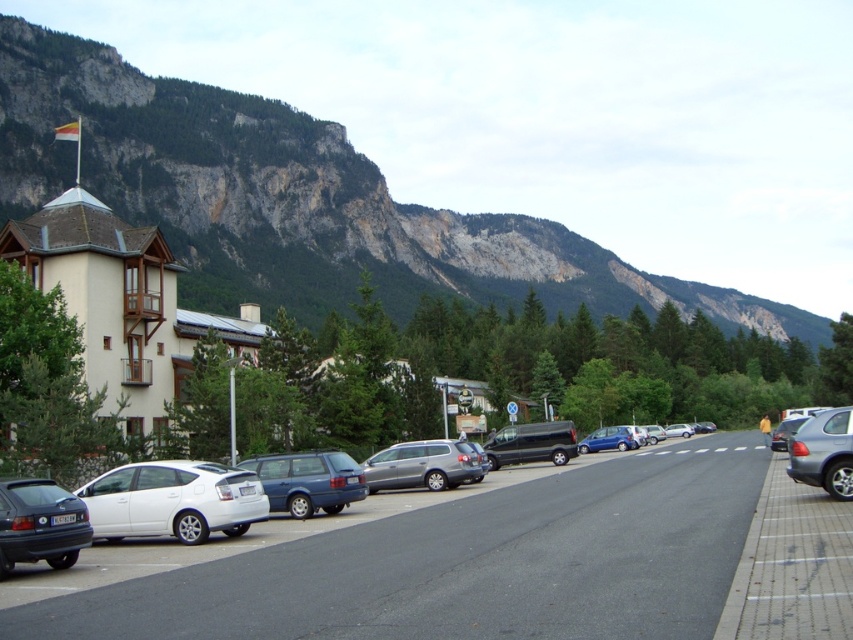
You are a delivery driver who needs to park your truck between the satin silver station wagon at center and the shiny black van at center. Your truck is 2.2 meters wide. Can you fit your truck between them?

The satin silver station wagon at center is wider than the shiny black van at center. However, the exact distance between them isn not provided, so it is impossible to determine if your truck can fit.